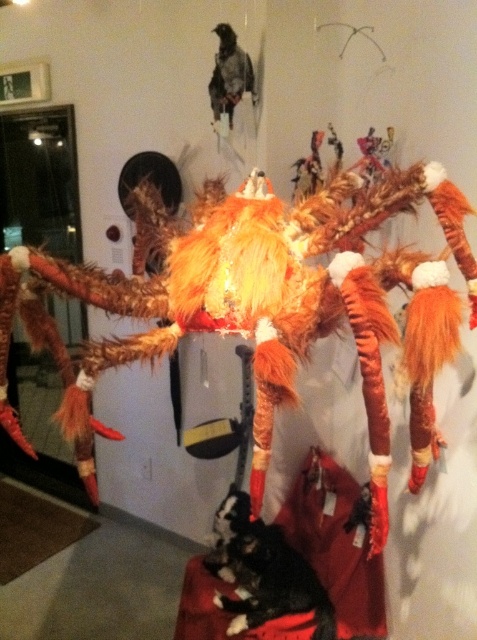
You are an art critic standing in front of the sculpture. You notice a fuzzy orange fox at center and a black fur cat at lower center. Which animal is positioned closer to you?

The fuzzy orange fox at center is closer to the viewer than the black fur cat at lower center.

You are an art curator planning to install a new lighting system in the gallery. The fuzzy orange fox at center and the black fur cat at lower center are part of the exhibit. Which animal sculpture should you adjust the lighting to highlight first if you want to emphasize height differences between them?

The fuzzy orange fox at center is much taller than the black fur cat at lower center, so you should adjust the lighting to highlight the fuzzy orange fox at center first to emphasize its height difference.